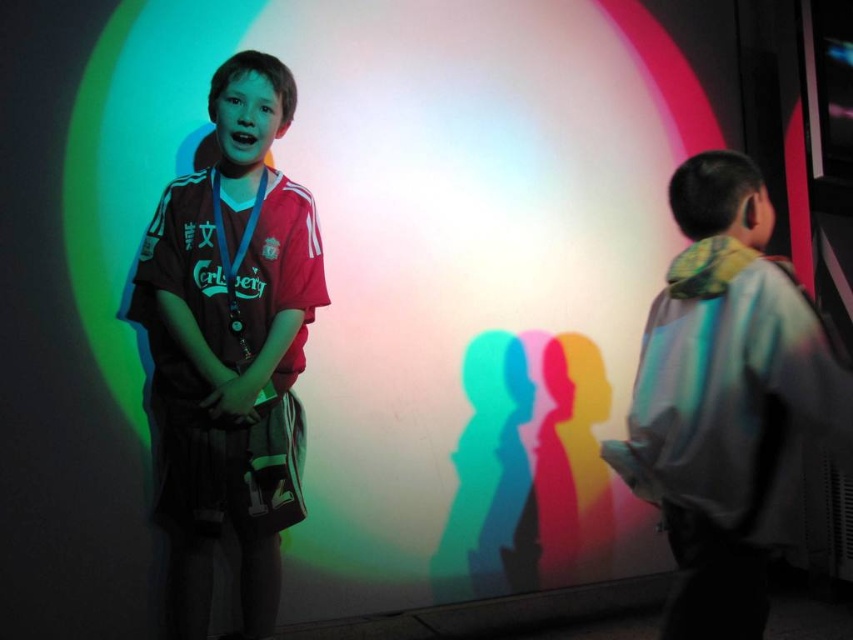
You are a photographer standing 2 meters away from the two children. You want to take a photo that includes both the matte red jersey at center and the light blue fabric jacket at right without any part of them being cut off. What is the minimum width of the camera lens you need to use?

The minimum width of the camera lens needed is at least 1.12 meters to ensure both the matte red jersey at center and the light blue fabric jacket at right are fully visible without any part being cut off.

You are a photographer trying to capture the exact position of the matte red jersey at center. According to the coordinates provided, where would you aim your camera?

The matte red jersey at center is located at coordinates point [230,348].